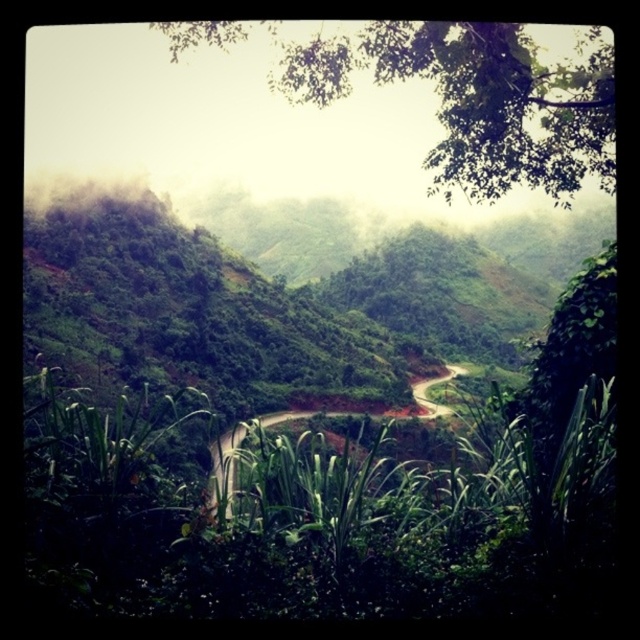
Based on the photo, does green leafy tree at upper center appear on the left side of dirt road at center?

Incorrect, green leafy tree at upper center is not on the left side of dirt road at center.

Does green leafy tree at upper center have a smaller size compared to dirt road at center?

No, green leafy tree at upper center is not smaller than dirt road at center.

Is point (397, 26) more distant than point (216, 477)?

No.

Where is `green leafy tree at upper center`? Image resolution: width=640 pixels, height=640 pixels. green leafy tree at upper center is located at coordinates (480, 100).